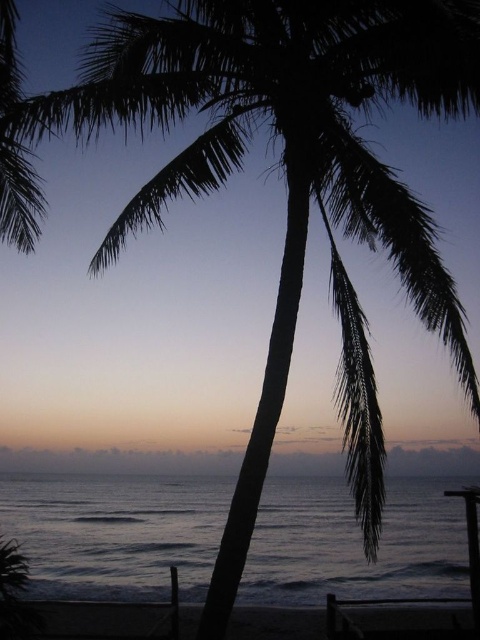
You are standing on the beach looking at the palm tree and the ocean. There are two points marked on the image. One is at coordinates point [22,483] and the other is at point [95,614]. Which point is closer to you?

Point [22,483] is further to the viewer than point [95,614], so the point closer to you is point [95,614].

Consider the image. You are standing on the beach and see the dark blue water at lower left and the dark sand at lower center. Which one is closer to the horizon?

The dark blue water at lower left has a lesser height compared to the dark sand at lower center, so it is closer to the horizon.

You are standing on the beach and want to walk from the dark sand at lower center to the dark blue water at lower left. Which direction should you move in?

Since the dark sand at lower center is behind the dark blue water at lower left, you should move towards the lower left direction to reach the dark blue water at lower left from the dark sand at lower center.